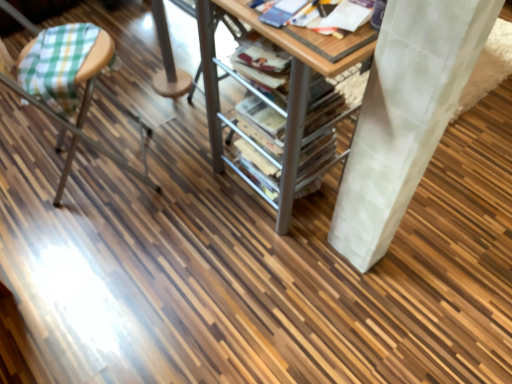
Identify the location of vacant space to the left of wooden table at center. (93, 165).